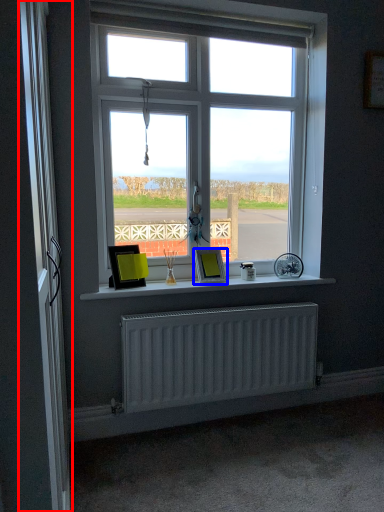
Question: Which object appears closest to the camera in this image, screen door (highlighted by a red box) or picture frame (highlighted by a blue box)?

Choices:
 (A) screen door
 (B) picture frame

Answer: (A)